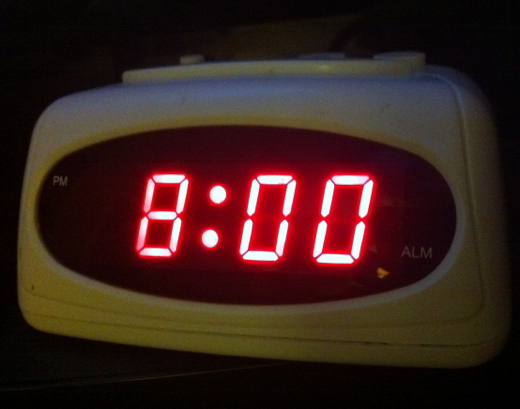
You are a GUI agent. You are given a task and a screenshot of the screen. Output one action in this format:
    pyautogui.click(x=<x>, y=<y>)
    Task: Click on the yellow clock
    Image resolution: width=520 pixels, height=409 pixels.
    Given the screenshot: What is the action you would take?
    pyautogui.click(x=208, y=115)